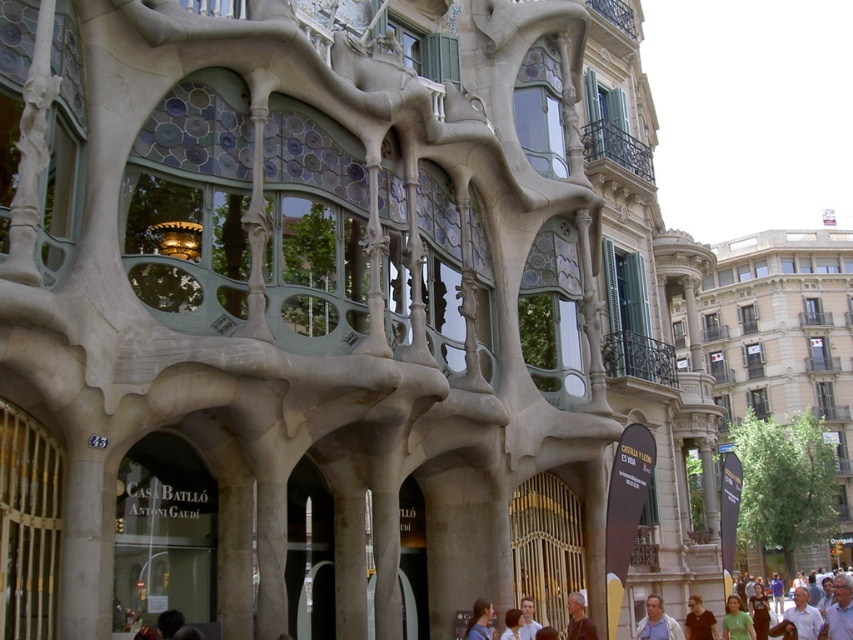
A person is standing in front of Casa Batll? and wants to take a photo of the blue denim shirt at lower center and smooth brown hair at center. If the camera can only focus on objects within 1.5 meters of each other, will both items be in focus?

The blue denim shirt at lower center and smooth brown hair at center are 1.71 meters apart, so the camera cannot focus on both items since they are farther than 1.5 meters apart.

You are a fashion designer observing the scene at Casa Batllo. You notice a blue denim shirt at lower center and a smooth brown hair at center. Which object is positioned more to the left?

The blue denim shirt at lower center is positioned more to the left than the smooth brown hair at center.

You are a tourist standing in front of Casa Batll? looking at the gray hair at lower center and the blue denim shirt at lower center. Which object is positioned to the right side?

The gray hair at lower center is positioned to the right of the blue denim shirt at lower center.